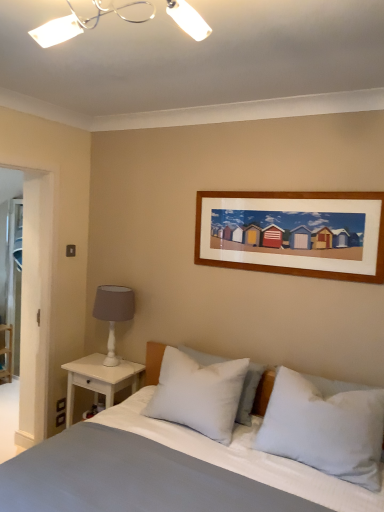
Identify the location of free space above white wood nightstand at left (from a real-world perspective). (100, 365).